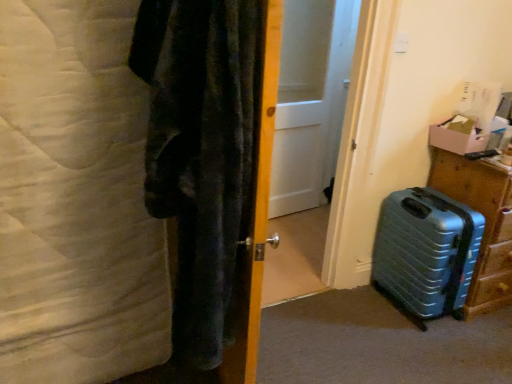
The image size is (512, 384). In order to click on free point above cardboard box at right (from a real-world perspective) in this screenshot , I will do `click(466, 127)`.